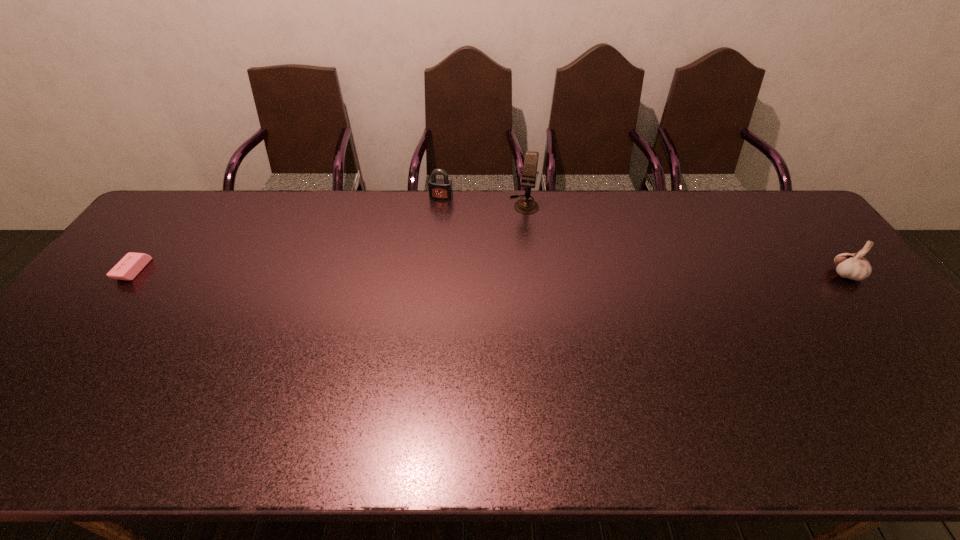
You are a GUI agent. You are given a task and a screenshot of the screen. Output one action in this format:
    pyautogui.click(x=<x>, y=<y>)
    Task: Click on the blank space located 0.150m on the front-facing side of the microphone
    Image resolution: width=960 pixels, height=540 pixels.
    Given the screenshot: What is the action you would take?
    pyautogui.click(x=516, y=243)

Where is `vacant area situated on the front of the third object from right to left near the keyhole`? This screenshot has height=540, width=960. vacant area situated on the front of the third object from right to left near the keyhole is located at coordinates (432, 218).

Find the location of a particular element. This screenshot has width=960, height=540. free space located on the front of the third object from right to left near the keyhole is located at coordinates (411, 273).

Find the location of a particular element. The image size is (960, 540). vacant space located on the front of the third object from right to left near the keyhole is located at coordinates (428, 228).

The width and height of the screenshot is (960, 540). I want to click on microphone that is at the far edge, so click(525, 206).

The height and width of the screenshot is (540, 960). Identify the location of padlock located at the far edge. (441, 189).

Find the location of a particular element. The width and height of the screenshot is (960, 540). object that is at the left edge is located at coordinates (131, 264).

Find the location of `object that is at the right edge`. object that is at the right edge is located at coordinates (854, 266).

Where is `vacant region at the far edge of the desktop`? Image resolution: width=960 pixels, height=540 pixels. vacant region at the far edge of the desktop is located at coordinates (558, 195).

Locate an element on the screen. This screenshot has width=960, height=540. vacant area at the near edge is located at coordinates (88, 397).